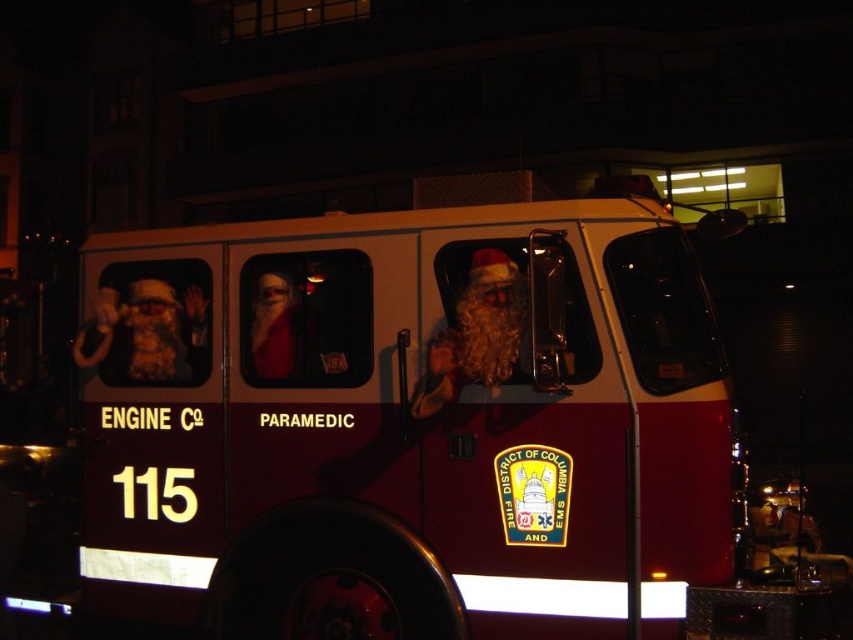
Question: Is maroon matte fire truck at center to the right of white fluffy santa at center from the viewer's perspective?

Choices:
 (A) no
 (B) yes

Answer: (A)

Question: Is maroon matte fire truck at center closer to the viewer compared to white fluffy santa at center?

Choices:
 (A) no
 (B) yes

Answer: (B)

Question: Can you confirm if maroon matte fire truck at center is positioned below white fluffy santa at center?

Choices:
 (A) no
 (B) yes

Answer: (B)

Question: Which object is closer to the camera taking this photo?

Choices:
 (A) white fluffy santa at center
 (B) maroon matte fire truck at center

Answer: (B)

Question: Which point is closer to the camera?

Choices:
 (A) (473, 323)
 (B) (207, 452)

Answer: (A)